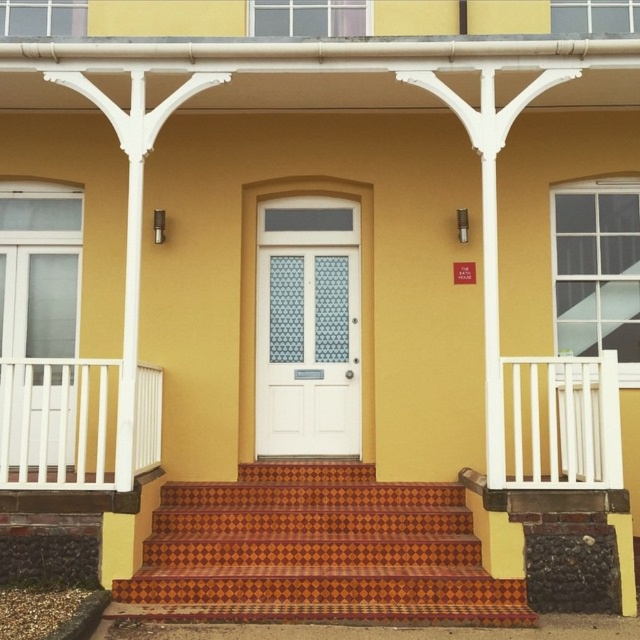
Question: Can you confirm if white wooden balustrade at left is thinner than white wooden balustrade at right?

Choices:
 (A) yes
 (B) no

Answer: (B)

Question: Estimate the real-world distances between objects in this image. Which object is closer to the terracotta checkered tile stairs at center?

Choices:
 (A) white glossy door at center
 (B) white wooden balustrade at left
 (C) white wooden balustrade at right

Answer: (A)

Question: In this image, where is white glossy door at center located relative to white wooden balustrade at right?

Choices:
 (A) above
 (B) below

Answer: (A)

Question: Can you confirm if terracotta checkered tile stairs at center is positioned to the right of white wooden balustrade at left?

Choices:
 (A) no
 (B) yes

Answer: (B)

Question: Among these objects, which one is farthest from the camera?

Choices:
 (A) white glossy door at center
 (B) white wooden balustrade at left

Answer: (A)

Question: Which point is farther to the camera?

Choices:
 (A) (397, 618)
 (B) (557, 406)

Answer: (B)